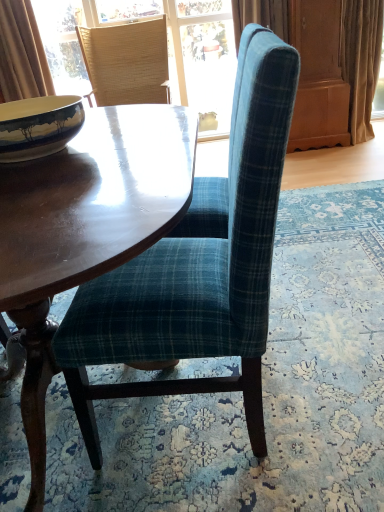
Question: Should I look upward or downward to see matte ceramic bowl at left?

Choices:
 (A) up
 (B) down

Answer: (A)

Question: Is shiny brown wood coffee table at center far away from woven straw chair at upper left, positioned as the 1th chair in top-to-bottom order?

Choices:
 (A) yes
 (B) no

Answer: (A)

Question: Is shiny brown wood coffee table at center to the right of woven straw chair at upper left, positioned as the first chair in back-to-front order, from the viewer's perspective?

Choices:
 (A) no
 (B) yes

Answer: (B)

Question: Considering the relative positions of shiny brown wood coffee table at center and woven straw chair at upper left, positioned as the second chair in bottom-to-top order, in the image provided, is shiny brown wood coffee table at center to the left of woven straw chair at upper left, positioned as the second chair in bottom-to-top order, from the viewer's perspective?

Choices:
 (A) yes
 (B) no

Answer: (B)

Question: Is shiny brown wood coffee table at center turned away from woven straw chair at upper left, marked as the 2th chair in a front-to-back arrangement?

Choices:
 (A) no
 (B) yes

Answer: (A)

Question: Is shiny brown wood coffee table at center beside woven straw chair at upper left, positioned as the second chair in bottom-to-top order?

Choices:
 (A) yes
 (B) no

Answer: (B)

Question: Is shiny brown wood coffee table at center thinner than woven straw chair at upper left, positioned as the second chair in bottom-to-top order?

Choices:
 (A) no
 (B) yes

Answer: (A)

Question: Does teal plaid fabric chair at center, arranged as the 2th chair when viewed from the back, have a smaller size compared to matte ceramic bowl at left?

Choices:
 (A) yes
 (B) no

Answer: (B)

Question: From the image's perspective, is teal plaid fabric chair at center, the 1th chair in the bottom-to-top sequence, located beneath matte ceramic bowl at left?

Choices:
 (A) no
 (B) yes

Answer: (B)

Question: Does teal plaid fabric chair at center, the 1th chair in the bottom-to-top sequence, have a greater height compared to matte ceramic bowl at left?

Choices:
 (A) no
 (B) yes

Answer: (B)

Question: Is teal plaid fabric chair at center, the 2th chair positioned from the top, further to camera compared to matte ceramic bowl at left?

Choices:
 (A) yes
 (B) no

Answer: (B)

Question: Can you confirm if teal plaid fabric chair at center, arranged as the 2th chair when viewed from the back, is thinner than matte ceramic bowl at left?

Choices:
 (A) yes
 (B) no

Answer: (B)

Question: From a real-world perspective, is teal plaid fabric chair at center, the first chair from the front, on top of matte ceramic bowl at left?

Choices:
 (A) yes
 (B) no

Answer: (B)

Question: Considering the relative sizes of beige fabric curtain at right, positioned as the second curtain in left-to-right order, and matte ceramic bowl at left in the image provided, is beige fabric curtain at right, positioned as the second curtain in left-to-right order, bigger than matte ceramic bowl at left?

Choices:
 (A) yes
 (B) no

Answer: (A)